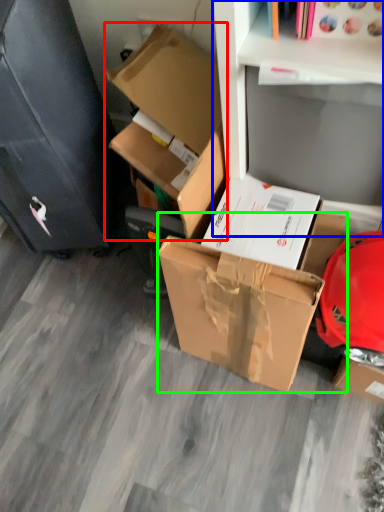
Question: Which object is the farthest from box (highlighted by a red box)? Choose among these: shelf (highlighted by a blue box) or box (highlighted by a green box).

Choices:
 (A) shelf
 (B) box

Answer: (B)